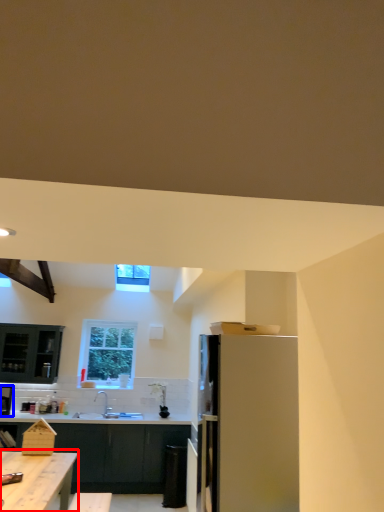
Question: Which of the following is the farthest to the observer, table (highlighted by a red box) or kitchen appliance (highlighted by a blue box)?

Choices:
 (A) table
 (B) kitchen appliance

Answer: (B)